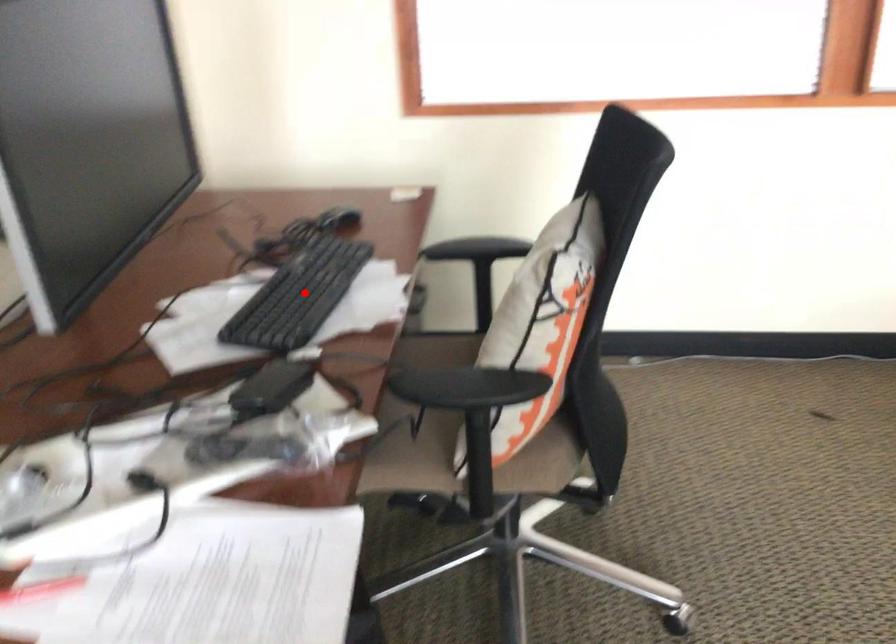
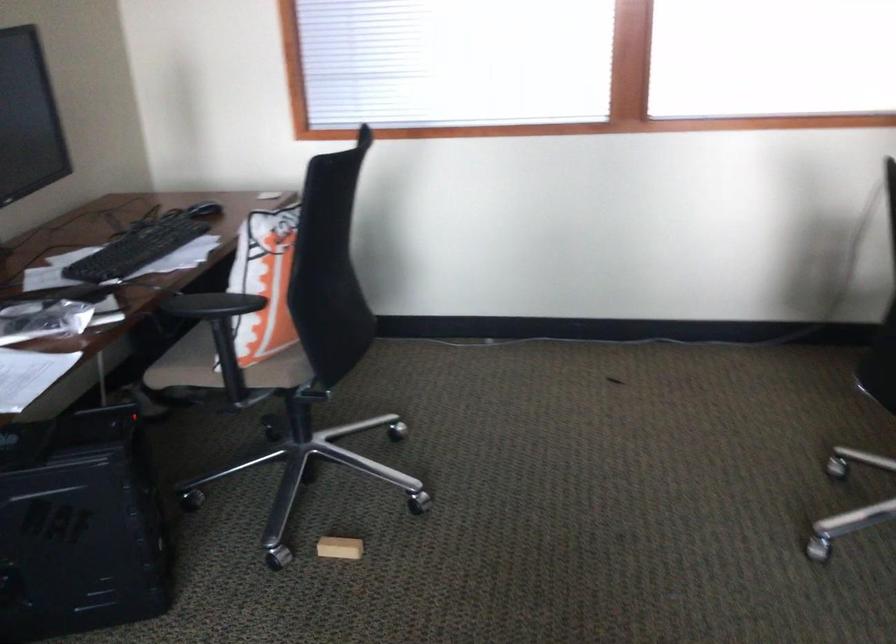
Question: I am providing you with two images of the same scene from different viewpoints. A red point is shown in image1. For the corresponding object point in image2, is it positioned nearer or farther from the camera?

Choices:
 (A) Nearer
 (B) Farther

Answer: (B)